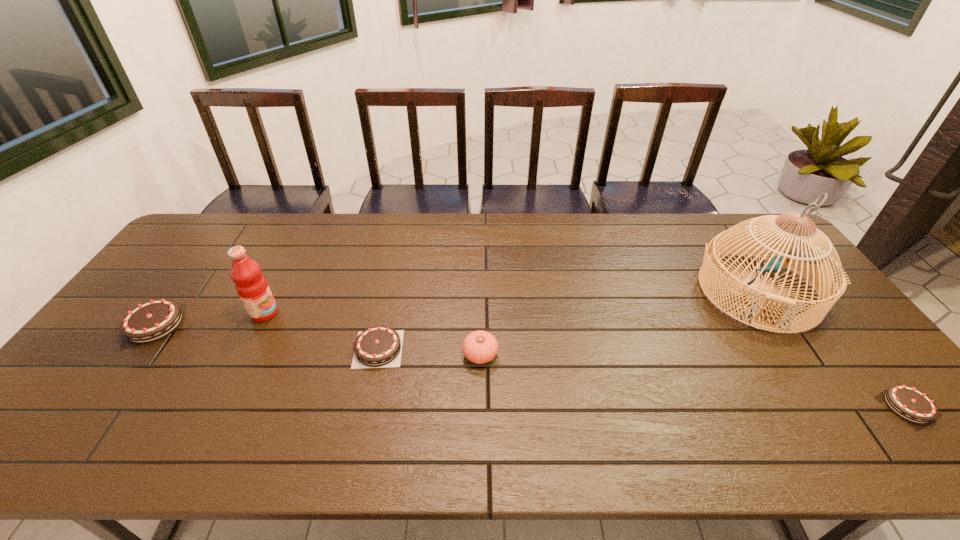
Please point a space for a new chocolate_cake to maintain equal intervals. Please provide its 2D coordinates. Your answer should be formatted as a tuple, i.e. [(x, y)], where the tuple contains the x and y coordinates of a point satisfying the conditions above.

[(628, 376)]